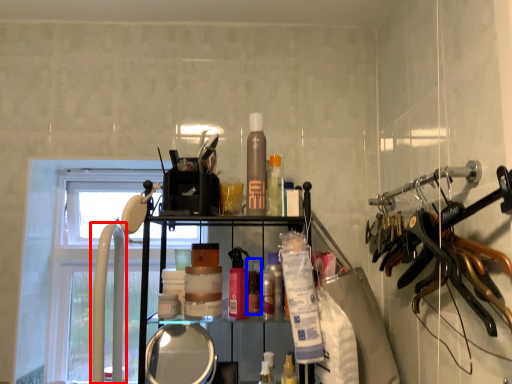
Question: Which object appears farthest to the camera in this image, faucet (highlighted by a red box) or toiletry (highlighted by a blue box)?

Choices:
 (A) faucet
 (B) toiletry

Answer: (B)